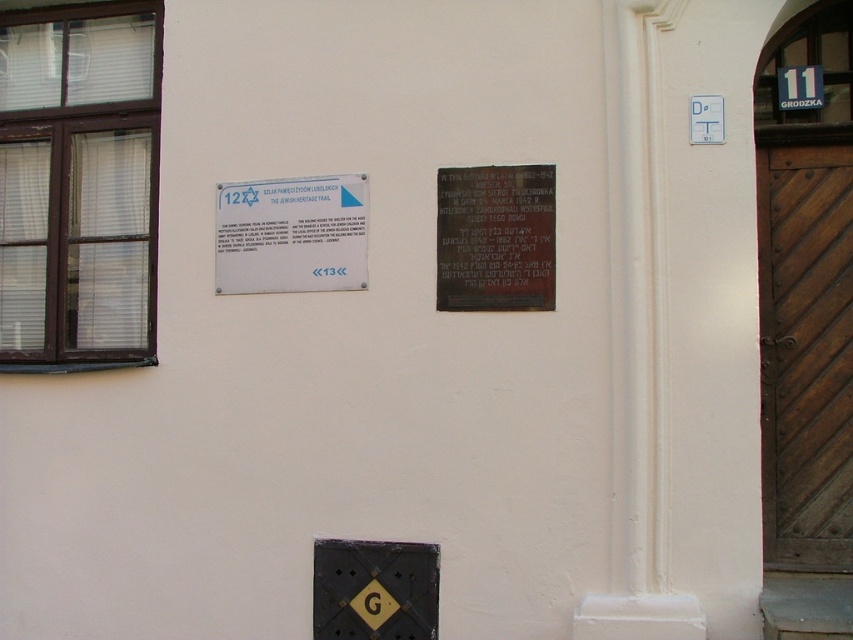
You are trying to enter the building and see the dark brown wooden door at right and the white paper sign at upper left. Which object is wider?

The white paper sign at upper left is wider than the dark brown wooden door at right.